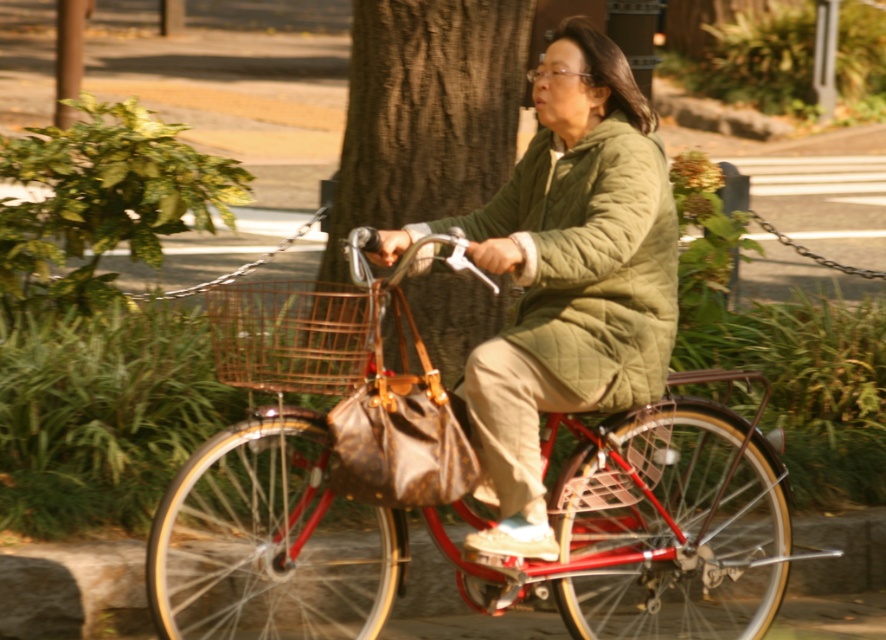
Question: Which of the following is the closest to the observer?

Choices:
 (A) (266, 372)
 (B) (550, 144)
 (C) (577, 340)

Answer: (A)

Question: Which of the following is the farthest from the observer?

Choices:
 (A) quilted olive green jacket at center
 (B) metallic red bicycle at center
 (C) brown textured tree trunk at center
 (D) quilted olive green coat at center

Answer: (C)

Question: Which object is farther from the camera taking this photo?

Choices:
 (A) quilted olive green jacket at center
 (B) quilted olive green coat at center

Answer: (A)

Question: Observing the image, what is the correct spatial positioning of quilted olive green coat at center in reference to quilted olive green jacket at center?

Choices:
 (A) right
 (B) left

Answer: (B)

Question: Where is metallic red bicycle at center located in relation to rusty metal basket at center in the image?

Choices:
 (A) above
 (B) below

Answer: (B)

Question: Does metallic red bicycle at center appear on the right side of quilted olive green coat at center?

Choices:
 (A) no
 (B) yes

Answer: (A)